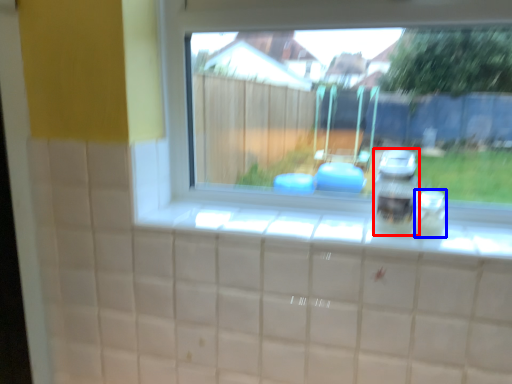
Question: Which object is closer to the camera taking this photo, appliance (highlighted by a red box) or glass jar (highlighted by a blue box)?

Choices:
 (A) appliance
 (B) glass jar

Answer: (A)